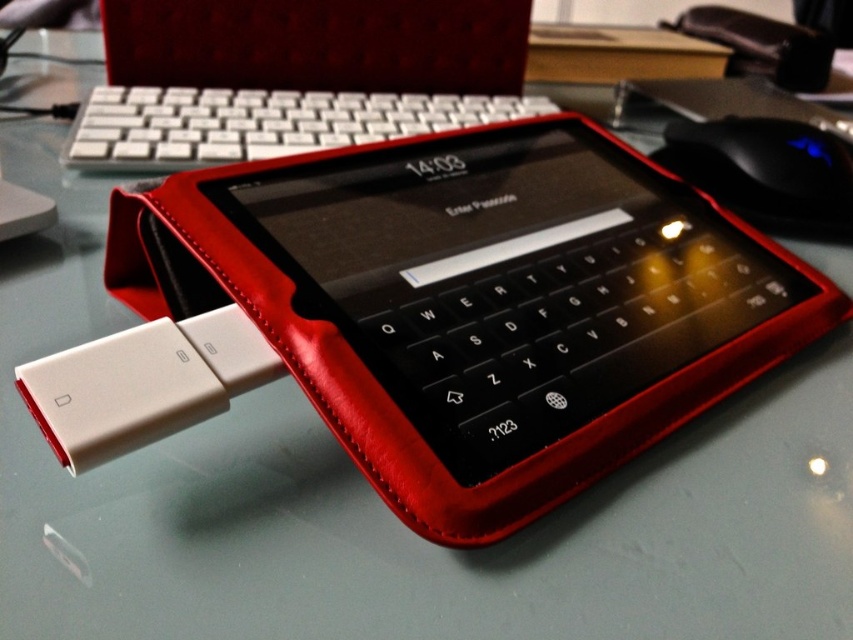
Question: Is white plastic keyboard at upper center to the left of black plastic mouse at upper right from the viewer's perspective?

Choices:
 (A) no
 (B) yes

Answer: (B)

Question: Can you confirm if white plastic keyboard at upper center is smaller than black plastic mouse at upper right?

Choices:
 (A) yes
 (B) no

Answer: (B)

Question: Is white plastic keyboard at upper center thinner than black plastic mouse at upper right?

Choices:
 (A) no
 (B) yes

Answer: (A)

Question: Among these points, which one is nearest to the camera?

Choices:
 (A) (766, 228)
 (B) (247, 148)

Answer: (B)

Question: Among these points, which one is nearest to the camera?

Choices:
 (A) (728, 164)
 (B) (103, 131)

Answer: (B)

Question: Which of the following is the farthest from the observer?

Choices:
 (A) (776, 177)
 (B) (178, 106)

Answer: (B)